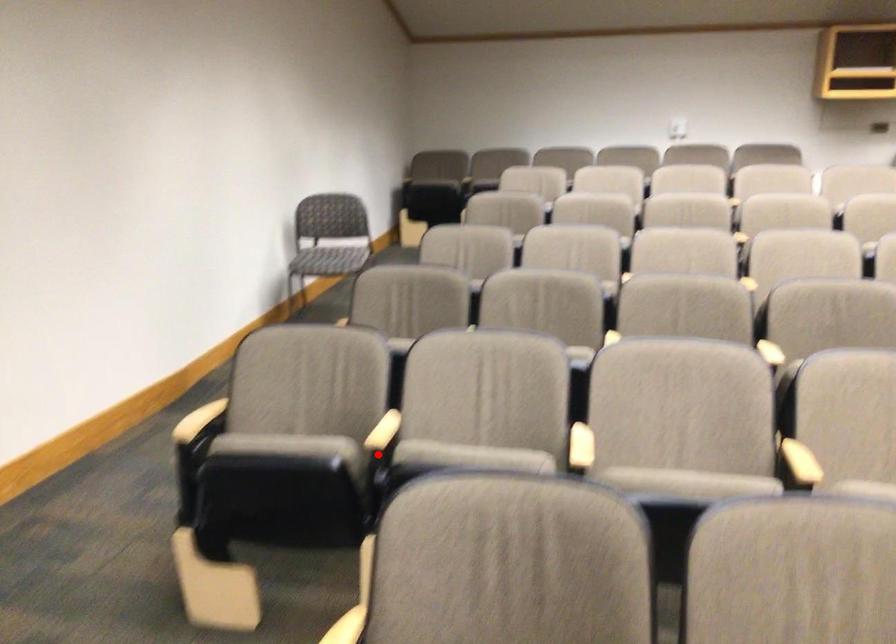
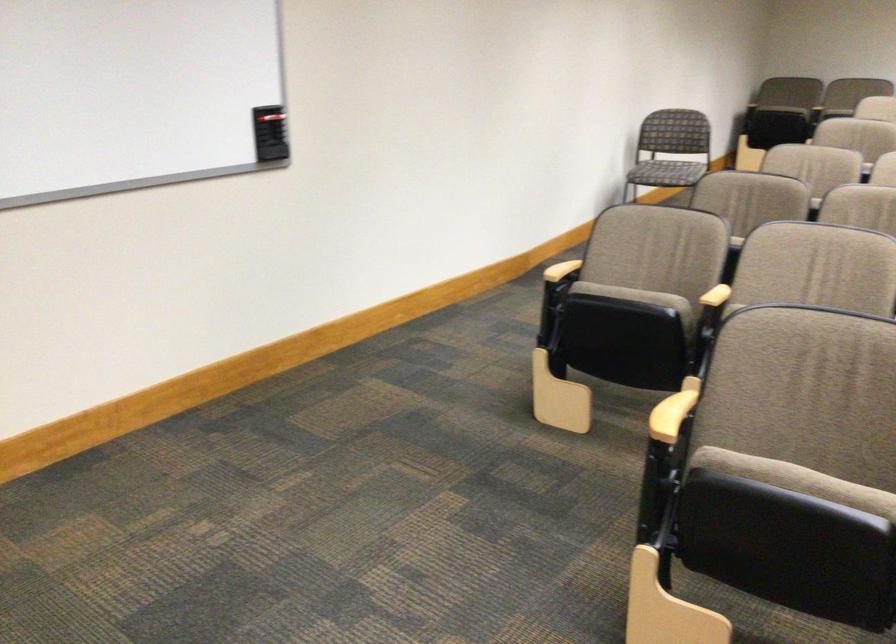
The point at the highlighted location is marked in the first image. Where is the corresponding point in the second image?

(716, 297)